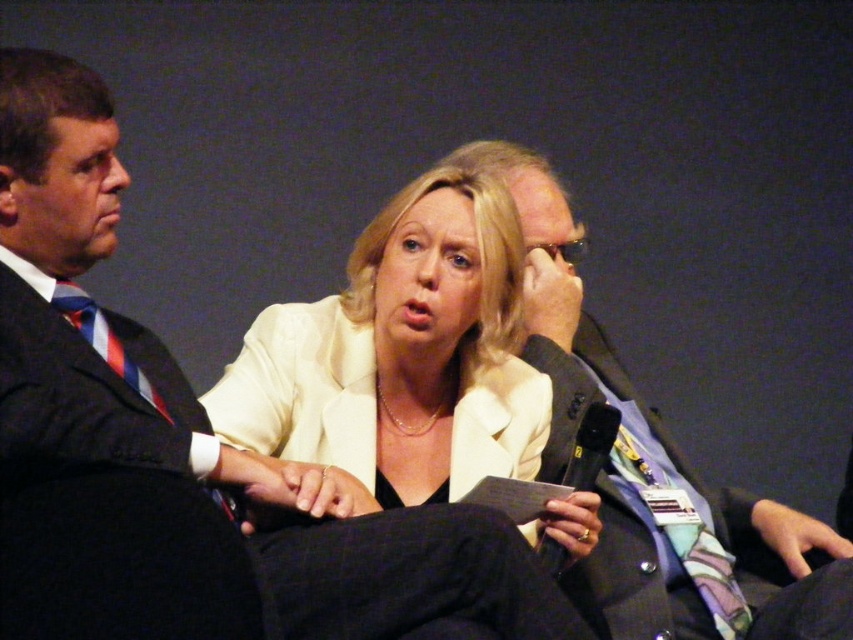
You are an event organizer who needs to arrange seating based on height. You have two attendees in view, the matte black suit at left and the white matte blazer at center. Which attendee should you seat in the front row to ensure visibility for both?

The white matte blazer at center should be seated in the front row because the matte black suit at left is much taller, and placing the shorter attendee in the front ensures better visibility for everyone.